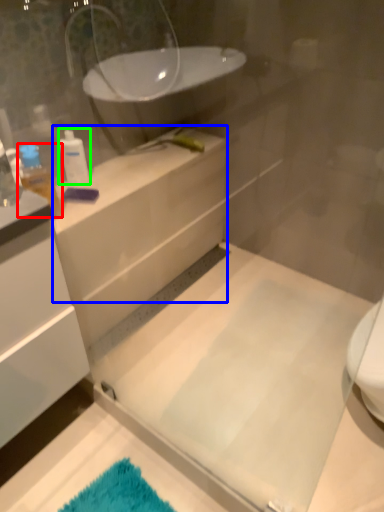
Question: Based on their relative distances, which object is farther from toiletry (highlighted by a red box)? Choose from counter top (highlighted by a blue box) and toiletry (highlighted by a green box).

Choices:
 (A) counter top
 (B) toiletry

Answer: (A)